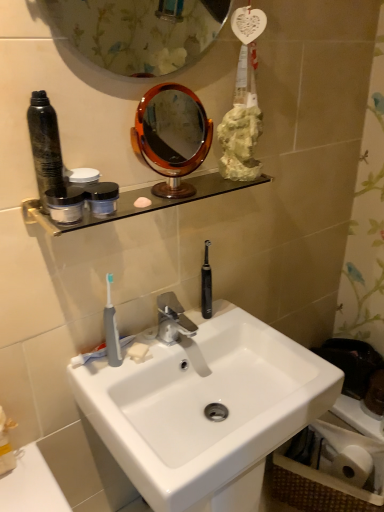
Question: In which direction should I rotate to look at gray rubber toothbrush at sink, arranged as the 2th toothbrush when viewed from the right?

Choices:
 (A) left
 (B) right

Answer: (A)

Question: Does white matte toilet tissue paper at lower right have a smaller size compared to clear glass shelf at upper center?

Choices:
 (A) yes
 (B) no

Answer: (B)

Question: Considering the relative sizes of white matte toilet tissue paper at lower right and clear glass shelf at upper center in the image provided, is white matte toilet tissue paper at lower right taller than clear glass shelf at upper center?

Choices:
 (A) yes
 (B) no

Answer: (A)

Question: Can you confirm if white matte toilet tissue paper at lower right is shorter than clear glass shelf at upper center?

Choices:
 (A) no
 (B) yes

Answer: (A)

Question: Is the depth of white matte toilet tissue paper at lower right greater than that of clear glass shelf at upper center?

Choices:
 (A) no
 (B) yes

Answer: (B)

Question: From the image's perspective, is white matte toilet tissue paper at lower right above clear glass shelf at upper center?

Choices:
 (A) yes
 (B) no

Answer: (B)

Question: From a real-world perspective, is white matte toilet tissue paper at lower right located higher than clear glass shelf at upper center?

Choices:
 (A) no
 (B) yes

Answer: (A)

Question: Would you say black rubber toothbrush at center, which ranks as the 1th toothbrush in right-to-left order, is part of white glossy sink at center's contents?

Choices:
 (A) no
 (B) yes

Answer: (A)

Question: Is white glossy sink at center smaller than black rubber toothbrush at center, which ranks as the 1th toothbrush in right-to-left order?

Choices:
 (A) yes
 (B) no

Answer: (B)

Question: Is white glossy sink at center looking in the opposite direction of black rubber toothbrush at center, the 2th toothbrush from the left?

Choices:
 (A) no
 (B) yes

Answer: (A)

Question: Can you confirm if white glossy sink at center is shorter than black rubber toothbrush at center, the 2th toothbrush when ordered from front to back?

Choices:
 (A) no
 (B) yes

Answer: (A)

Question: Considering the relative sizes of white glossy sink at center and black rubber toothbrush at center, the 2th toothbrush when ordered from front to back, in the image provided, is white glossy sink at center bigger than black rubber toothbrush at center, the 2th toothbrush when ordered from front to back,?

Choices:
 (A) yes
 (B) no

Answer: (A)

Question: From the image's perspective, does white glossy sink at center appear lower than black rubber toothbrush at center, which ranks as the 1th toothbrush in right-to-left order?

Choices:
 (A) yes
 (B) no

Answer: (A)

Question: Does black rubber toothbrush at center, the 2th toothbrush when ordered from front to back, have a larger size compared to white matte soap at sink?

Choices:
 (A) no
 (B) yes

Answer: (B)